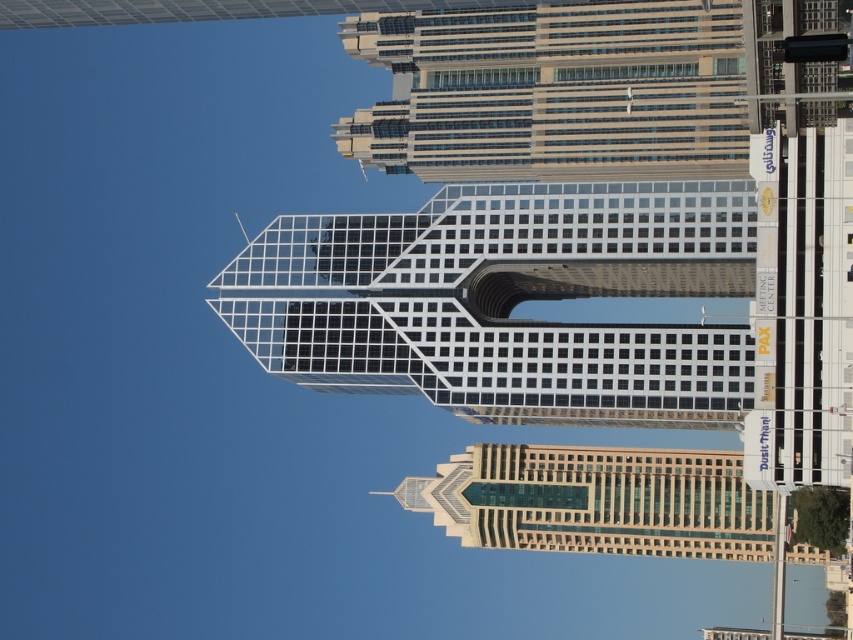
You are standing in the city square and see the transparent glass tower at center and the glassy steel skyscraper at upper center. Which building is closer to you?

The transparent glass tower at center is closer to you because it is positioned in front of the glassy steel skyscraper at upper center.

You are a drone operator who needs to deliver a package from the transparent glass tower at center to the glassy steel skyscraper at upper center. The drone can only fly up to 30 meters. Can the drone make the delivery?

The transparent glass tower at center is 30.64 meters from the glassy steel skyscraper at upper center. Since the drone can only fly up to 30 meters, it cannot make the delivery as the distance exceeds its range.